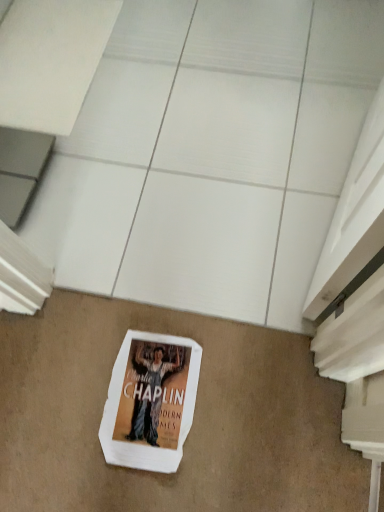
Locate an element on the screen. white paper flyer at center is located at coordinates (150, 401).

Consider the image. What is the approximate height of white paper flyer at center?

white paper flyer at center is 0.88 inches tall.

What do you see at coordinates (150, 401) in the screenshot? Image resolution: width=384 pixels, height=512 pixels. I see `white paper flyer at center` at bounding box center [150, 401].

Find the location of a particular element. white paper flyer at center is located at coordinates (150, 401).